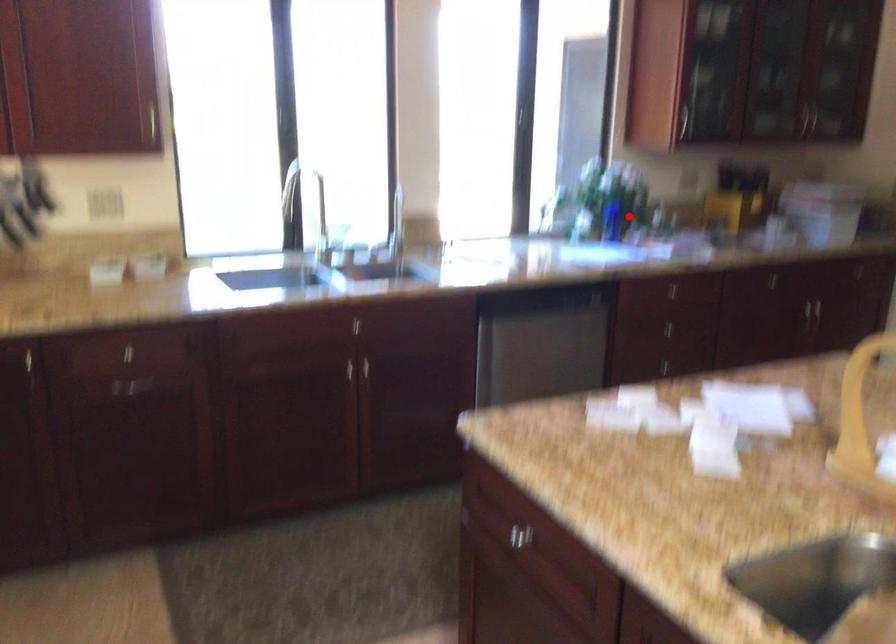
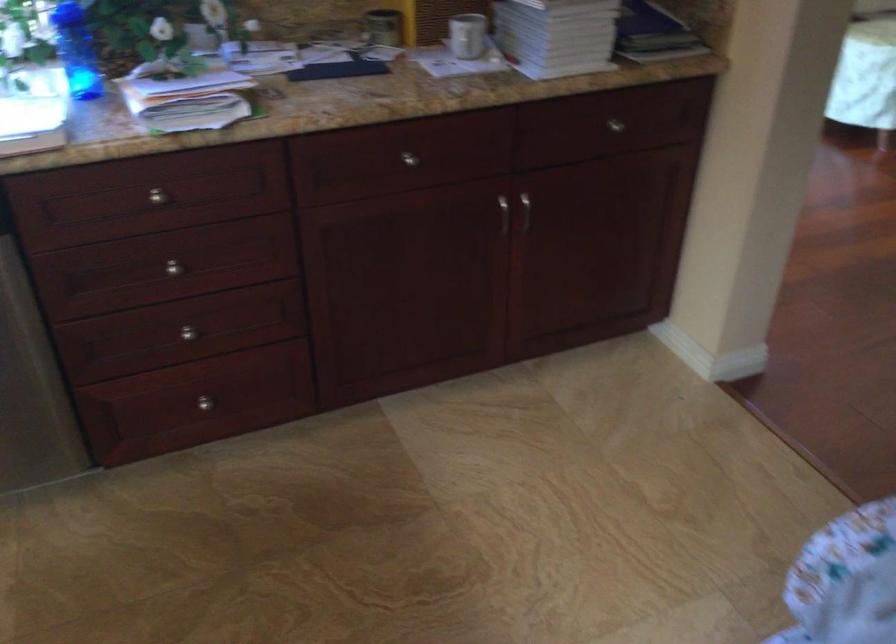
Question: I am providing you with two images of the same scene from different viewpoints. A red point is shown in image1. For the corresponding object point in image2, is it positioned nearer or farther from the camera?

Choices:
 (A) Nearer
 (B) Farther

Answer: (A)